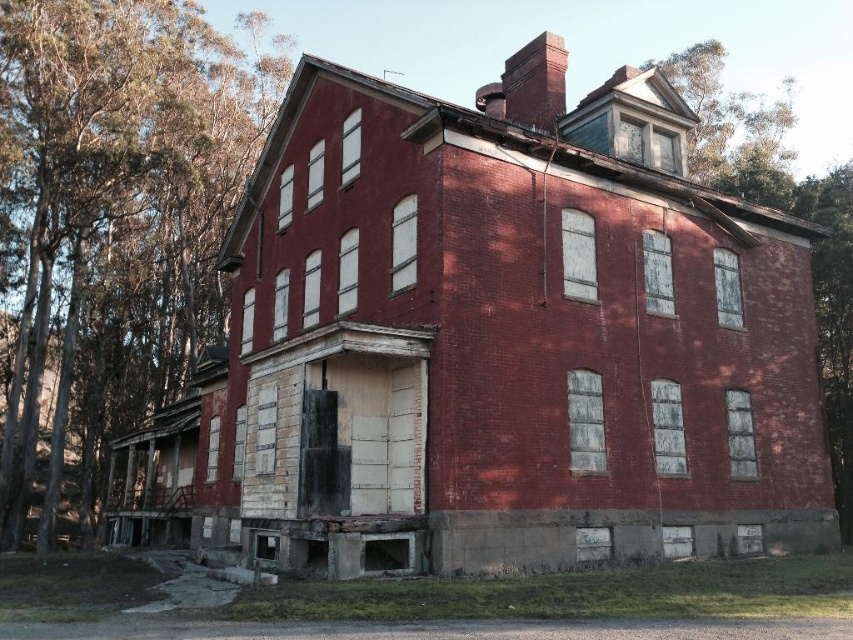
Is the position of green leafy tree at left less distant than that of smooth bark tree at upper right?

No, green leafy tree at left is further to the viewer.

Image resolution: width=853 pixels, height=640 pixels. What are the coordinates of `green leafy tree at left` in the screenshot? It's located at (111, 228).

At what (x,y) coordinates should I click in order to perform the action: click on green leafy tree at left. Please return your answer as a coordinate pair (x, y). Looking at the image, I should click on (111, 228).